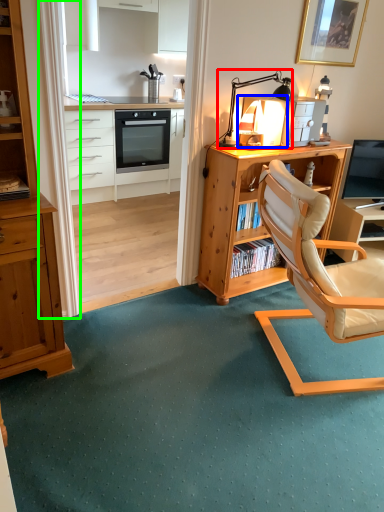
Question: Which is nearer to the table lamp (highlighted by a red box)? appliance (highlighted by a blue box) or curtain (highlighted by a green box).

Choices:
 (A) appliance
 (B) curtain

Answer: (A)